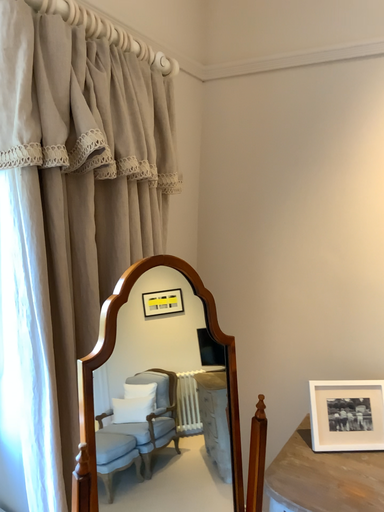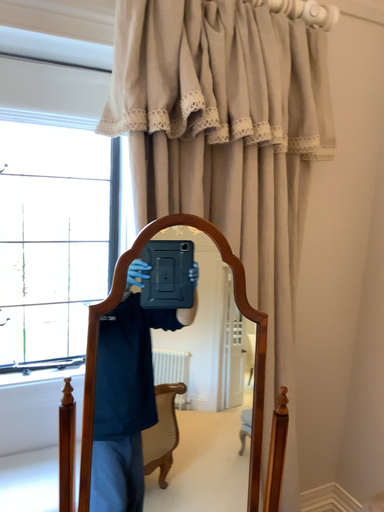
Question: Which way did the camera rotate in the video?

Choices:
 (A) rotated right
 (B) rotated left

Answer: (B)